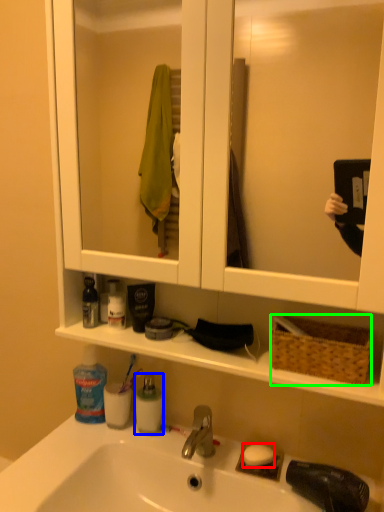
Question: Which is farther away from soap (highlighted by a red box)? cleaning product (highlighted by a blue box) or picnic basket (highlighted by a green box)?

Choices:
 (A) cleaning product
 (B) picnic basket

Answer: (B)